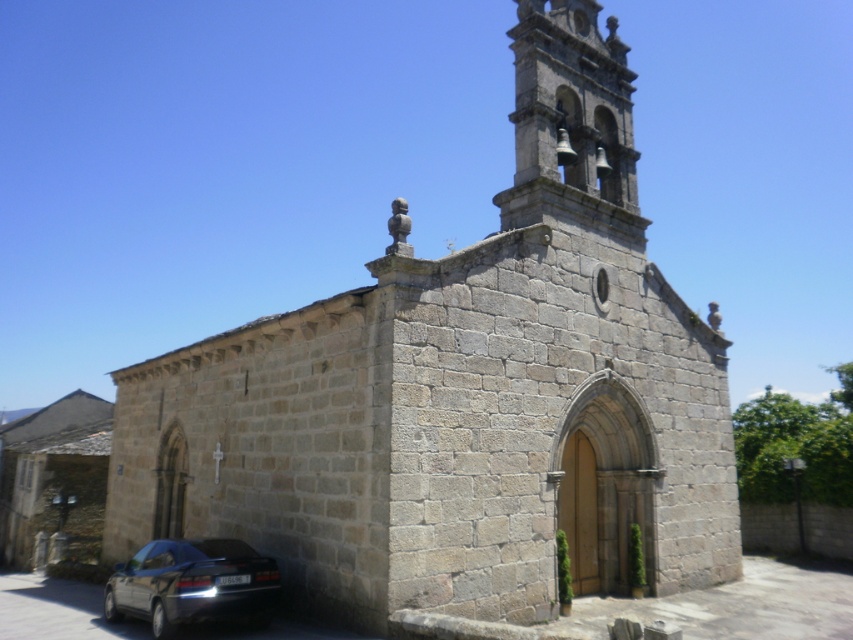
You are standing at the point marked as point (590, 192). The two entrances of the stone church are located at two different positions. How far apart are the two entrances?

The two entrances are 52.13 feet apart.

You are a photographer standing in front of the church. You want to take a picture of the dark gray metallic car at lower left without the gray stone bell tower at upper right blocking it. Is this possible?

The dark gray metallic car at lower left is behind the gray stone bell tower at upper right, so it is blocked by the tower. Therefore, you cannot take a picture of the car without the tower blocking it.

You are standing in front of the church and want to locate the gray stone bell tower at upper right and the dark gray metallic car at lower left. Based on their positions, which object is closer to the right side of the church?

The gray stone bell tower at upper right is closer to the right side of the church because it is positioned to the right of the dark gray metallic car at lower left.